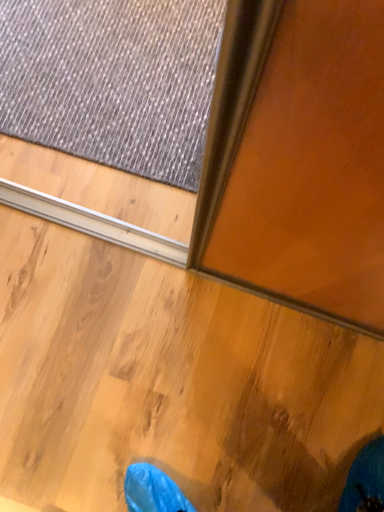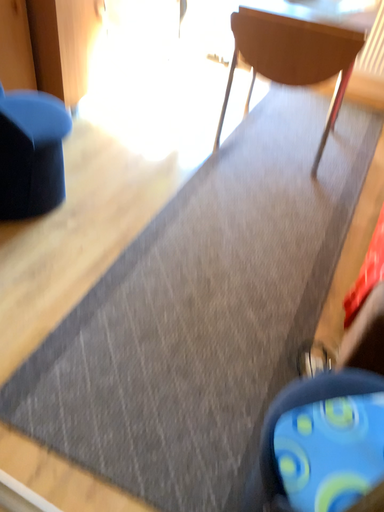
Question: How did the camera likely rotate when shooting the video?

Choices:
 (A) rotated upward
 (B) rotated downward

Answer: (A)